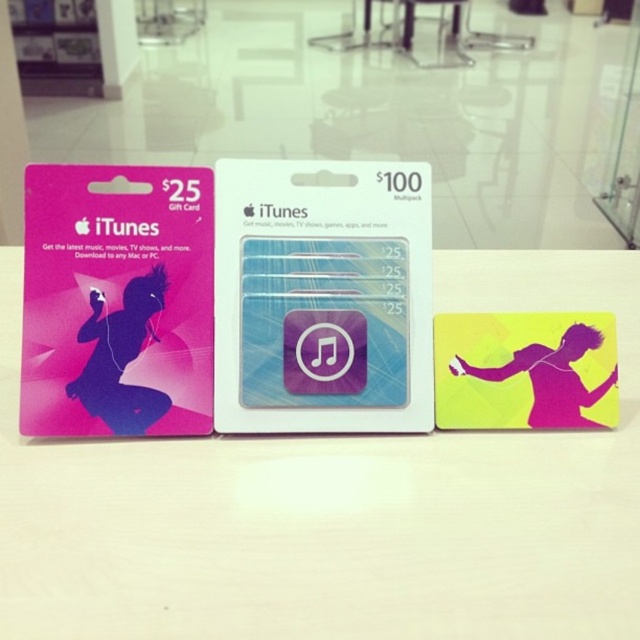
Question: Which point appears farthest from the camera in this image?

Choices:
 (A) (108, 326)
 (B) (490, 378)
 (C) (390, 516)

Answer: (B)

Question: Is white matte table at center smaller than silhouette paper at center?

Choices:
 (A) yes
 (B) no

Answer: (B)

Question: Estimate the real-world distances between objects in this image. Which object is farther from the silhouette glossy card at left?

Choices:
 (A) white matte table at center
 (B) silhouette paper at center

Answer: (B)

Question: Can you confirm if white matte table at center is wider than silhouette glossy card at left?

Choices:
 (A) yes
 (B) no

Answer: (A)

Question: Does white matte table at center appear on the left side of silhouette paper at center?

Choices:
 (A) yes
 (B) no

Answer: (A)

Question: Which is farther from the white matte table at center?

Choices:
 (A) silhouette paper at center
 (B) silhouette glossy card at left

Answer: (B)